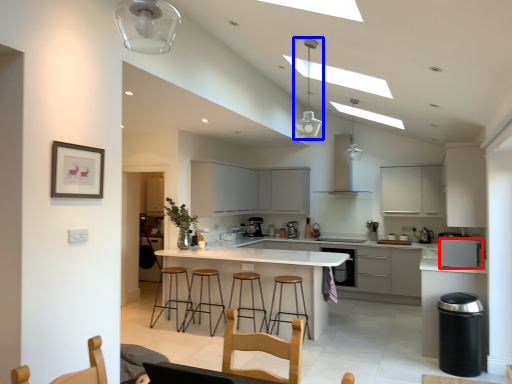
Question: Which object is closer to the camera taking this photo, kitchen appliance (highlighted by a red box) or light fixture (highlighted by a blue box)?

Choices:
 (A) kitchen appliance
 (B) light fixture

Answer: (B)